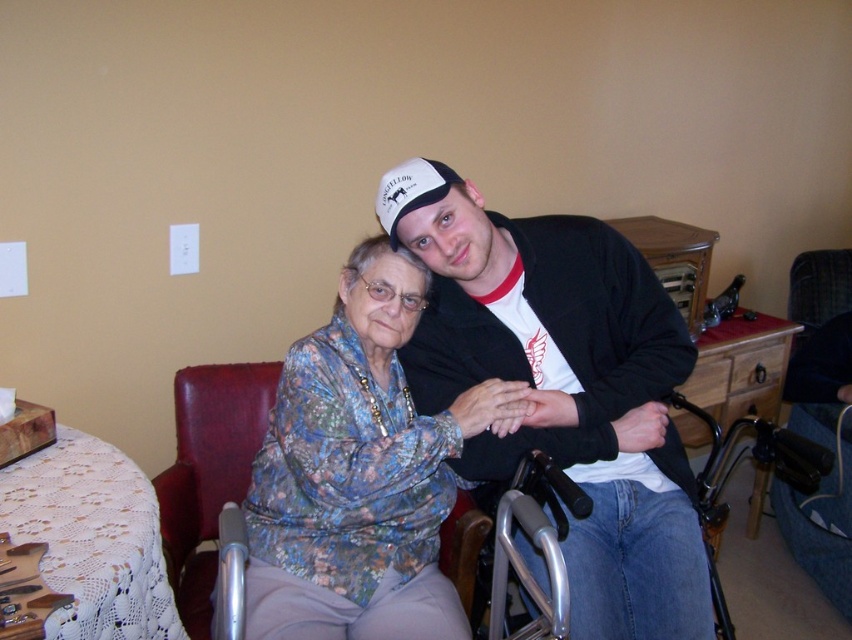
Which of these two, floral fabric blouse at center or silver metallic wheelchair at lower right, stands shorter?

Standing shorter between the two is silver metallic wheelchair at lower right.

Can you confirm if floral fabric blouse at center is positioned above silver metallic wheelchair at lower right?

Indeed, floral fabric blouse at center is positioned over silver metallic wheelchair at lower right.

Which is behind, point (413, 296) or point (707, 484)?

Point (707, 484)

Where is `floral fabric blouse at center`? floral fabric blouse at center is located at coordinates (360, 474).

Image resolution: width=852 pixels, height=640 pixels. What do you see at coordinates (208, 472) in the screenshot?
I see `leather at left` at bounding box center [208, 472].

Is leather at left to the right of white matte baseball cap at upper center from the viewer's perspective?

No, leather at left is not to the right of white matte baseball cap at upper center.

The width and height of the screenshot is (852, 640). I want to click on leather at left, so click(x=208, y=472).

The width and height of the screenshot is (852, 640). I want to click on leather at left, so click(x=208, y=472).

Can you confirm if matte black jacket at center is positioned below silver metallic wheelchair at lower right?

No, matte black jacket at center is not below silver metallic wheelchair at lower right.

Consider the image. Does matte black jacket at center have a smaller size compared to silver metallic wheelchair at lower right?

Incorrect, matte black jacket at center is not smaller in size than silver metallic wheelchair at lower right.

Does point (444, 394) come behind point (527, 464)?

Yes, point (444, 394) is behind point (527, 464).

Find the location of a particular element. This screenshot has height=640, width=852. matte black jacket at center is located at coordinates (563, 387).